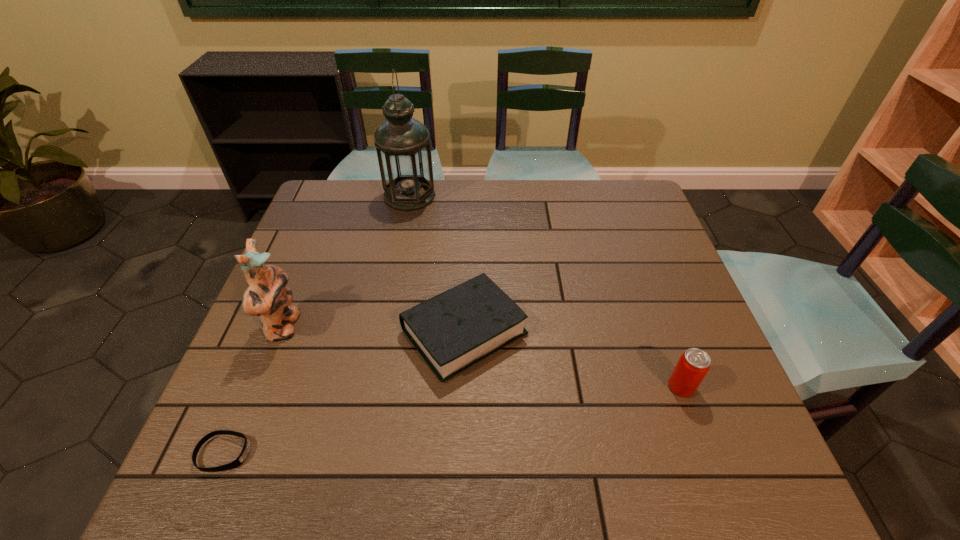
Find the location of `the farthest object`. the farthest object is located at coordinates (402, 143).

This screenshot has height=540, width=960. What are the coordinates of `the tallest object` in the screenshot? It's located at (402, 143).

I want to click on figurine, so click(267, 297).

The image size is (960, 540). Identify the location of the third tallest object. (693, 365).

Find the location of a particular element. This screenshot has width=960, height=540. the rightmost object is located at coordinates (693, 365).

Where is `Bible`? The image size is (960, 540). Bible is located at coordinates (452, 331).

Locate an element on the screen. The height and width of the screenshot is (540, 960). the shortest object is located at coordinates (237, 462).

Identify the location of wristband. (237, 462).

This screenshot has width=960, height=540. Identify the location of vacant space situated on the right of the tallest object. (525, 196).

Locate an element on the screen. Image resolution: width=960 pixels, height=540 pixels. free space located on the front-facing side of the figurine is located at coordinates (329, 327).